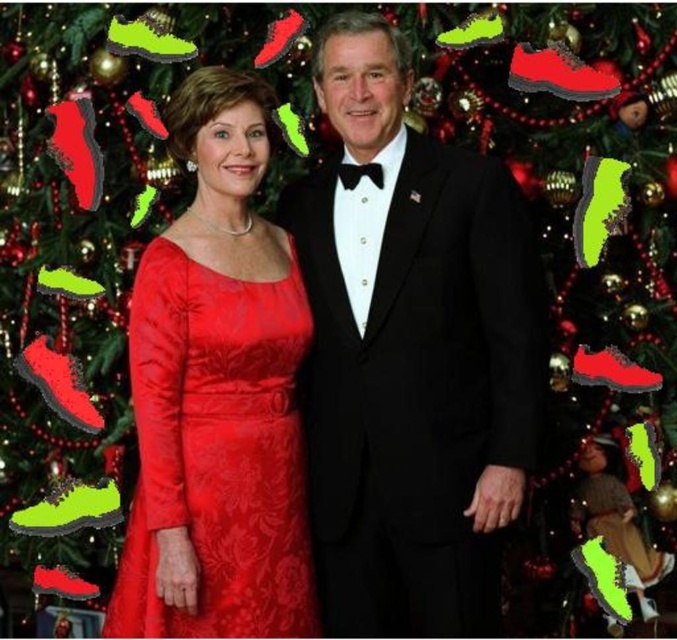
You are standing in front of the Christmas tree and need to locate the black satin suit at center. According to the coordinates provided, where would you find it?

The black satin suit at center is located at coordinates point (410, 353).

You are planning to take a photo of the black satin suit at center and the matte velvet dress at center. Based on their heights, which one should you focus on first to ensure both are in frame?

The black satin suit at center is much taller than the matte velvet dress at center, so you should focus on the black satin suit at center first to ensure both are in frame.